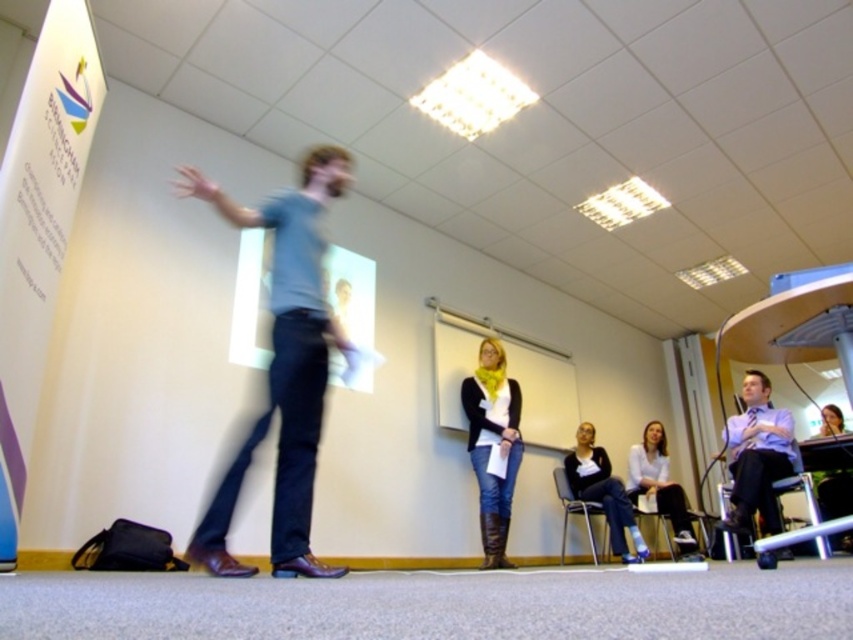
Does denim jeans at center have a greater width compared to white shirt at lower right?

Incorrect, denim jeans at center's width does not surpass white shirt at lower right's.

Can you confirm if denim jeans at center is positioned to the left of white shirt at lower right?

Indeed, denim jeans at center is positioned on the left side of white shirt at lower right.

Who is more distant from viewer, [490,474] or [657,499]?

Point [657,499]

Image resolution: width=853 pixels, height=640 pixels. I want to click on denim jeans at center, so click(492, 445).

Is point (836, 492) positioned in front of point (569, 497)?

Yes, it is in front of point (569, 497).

Identify the location of green fabric chair at lower right. The height and width of the screenshot is (640, 853). (834, 492).

Does point (286, 332) come in front of point (824, 408)?

Yes, it is in front of point (824, 408).

Locate an element on the screen. blue cotton shirt at center is located at coordinates (283, 365).

This screenshot has width=853, height=640. In order to click on blue cotton shirt at center in this screenshot , I will do `click(283, 365)`.